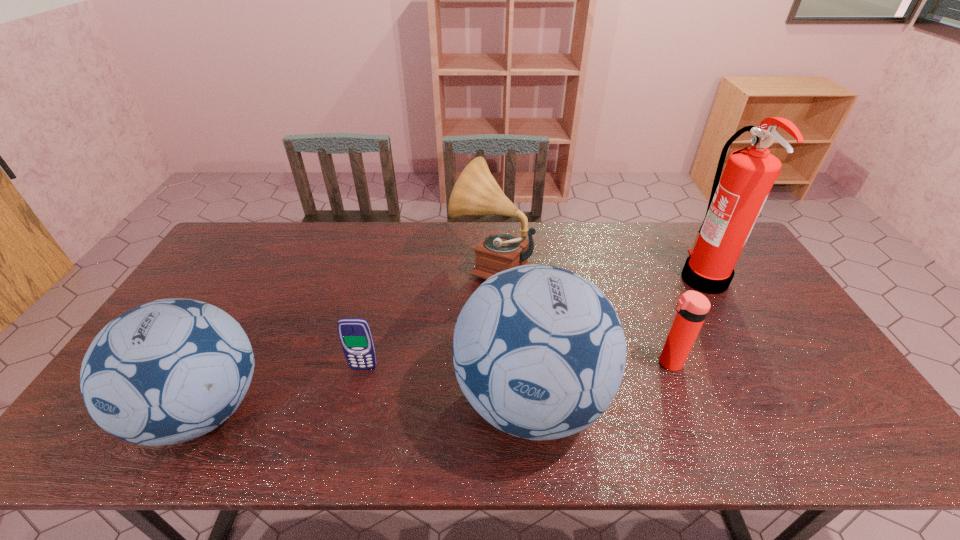
Locate an element on the screen. The height and width of the screenshot is (540, 960). vacant space situated 0.130m with the nozzle aimed from the rightmost object is located at coordinates (641, 278).

Where is `free region located with the nozzle aimed from the rightmost object`? free region located with the nozzle aimed from the rightmost object is located at coordinates (586, 278).

This screenshot has width=960, height=540. In order to click on free point located 0.180m with the nozzle aimed from the rightmost object in this screenshot , I will do `click(626, 278)`.

Locate an element on the screen. blank space located on the front-facing side of the cellular telephone is located at coordinates (356, 401).

Where is `free region located on the horn of the phonograph record`? This screenshot has width=960, height=540. free region located on the horn of the phonograph record is located at coordinates (368, 265).

In order to click on free space located 0.190m on the horn of the phonograph record in this screenshot , I will do `click(395, 265)`.

At what (x,y) coordinates should I click in order to perform the action: click on free space located 0.160m on the horn of the phonograph record. Please return your answer as a coordinate pair (x, y). This screenshot has height=540, width=960. Looking at the image, I should click on click(x=404, y=265).

Locate an element on the screen. This screenshot has width=960, height=540. free region located on the right of the thermos bottle is located at coordinates (732, 362).

Locate an element on the screen. Image resolution: width=960 pixels, height=540 pixels. fire extinguisher that is at the far edge is located at coordinates (735, 203).

I want to click on phonograph record at the far edge, so click(476, 192).